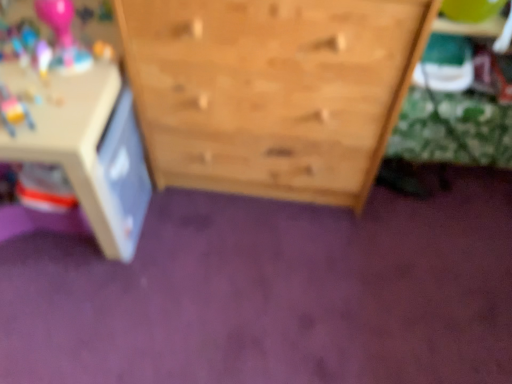
Locate an element on the screen. The height and width of the screenshot is (384, 512). vacant space in front of natural wood chest of drawers at center is located at coordinates (258, 283).